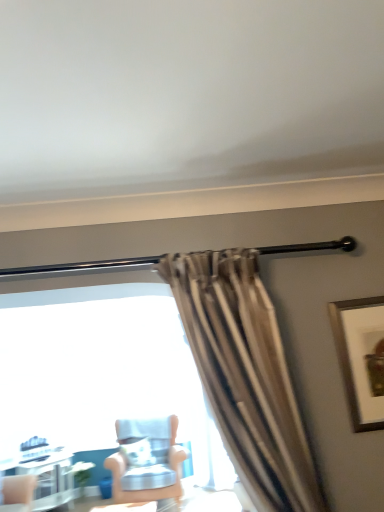
Identify the location of wooden framed artwork at upper right. This screenshot has width=384, height=512. (361, 358).

Can you confirm if light blue fabric chair at center is taller than white glossy table at lower left?

Indeed, light blue fabric chair at center has a greater height compared to white glossy table at lower left.

Is point (161, 471) positioned before point (47, 508)?

Yes, it is.

From a real-world perspective, is light blue fabric chair at center on white glossy table at lower left?

Indeed, from a real-world perspective, light blue fabric chair at center stands above white glossy table at lower left.

Can you confirm if light blue fabric chair at center is thinner than white glossy table at lower left?

In fact, light blue fabric chair at center might be wider than white glossy table at lower left.

Who is more distant, white glossy table at lower left or light blue fabric chair at center?

white glossy table at lower left is further from the camera.

Based on their positions, is white glossy table at lower left located to the left or right of light blue fabric chair at center?

Based on their positions, white glossy table at lower left is located to the left of light blue fabric chair at center.

From a real-world perspective, relative to light blue fabric chair at center, is white glossy table at lower left vertically above or below?

Clearly, from a real-world perspective, white glossy table at lower left is below light blue fabric chair at center.

In the scene shown: From the image's perspective, would you say white glossy table at lower left is positioned over light blue fabric chair at center?

No.

From the image's perspective, which is below, light blue fabric chair at center or wooden framed artwork at upper right?

light blue fabric chair at center.

Is light blue fabric chair at center far from wooden framed artwork at upper right?

Yes, light blue fabric chair at center is far from wooden framed artwork at upper right.

From the image's perspective, is wooden framed artwork at upper right on top of white glossy table at lower left?

Yes, from the image's perspective, wooden framed artwork at upper right is over white glossy table at lower left.

Locate an element on the screen. table located underneath the wooden framed artwork at upper right (from a real-world perspective) is located at coordinates (48, 477).

From a real-world perspective, is wooden framed artwork at upper right over white glossy table at lower left?

Indeed, from a real-world perspective, wooden framed artwork at upper right stands above white glossy table at lower left.

Which is behind, point (367, 366) or point (35, 449)?

The point (35, 449) is behind.

Considering the relative sizes of white glossy table at lower left and wooden framed artwork at upper right in the image provided, is white glossy table at lower left taller than wooden framed artwork at upper right?

Yes.

In the scene shown: Which of these two, white glossy table at lower left or wooden framed artwork at upper right, is thinner?

wooden framed artwork at upper right is thinner.

Is white glossy table at lower left far from wooden framed artwork at upper right?

white glossy table at lower left is far away from wooden framed artwork at upper right.

Is white glossy table at lower left smaller than wooden framed artwork at upper right?

No, white glossy table at lower left is not smaller than wooden framed artwork at upper right.

From the picture: From their relative heights in the image, would you say wooden framed artwork at upper right is taller or shorter than light blue fabric chair at center?

Clearly, wooden framed artwork at upper right is shorter compared to light blue fabric chair at center.

Considering the sizes of objects wooden framed artwork at upper right and light blue fabric chair at center in the image provided, who is wider, wooden framed artwork at upper right or light blue fabric chair at center?

Wider between the two is light blue fabric chair at center.

From a real-world perspective, which object stands above the other?

wooden framed artwork at upper right, from a real-world perspective.

Is light blue fabric chair at center located within wooden framed artwork at upper right?

No.

Find the location of a particular element. Image resolution: width=384 pixels, height=512 pixels. table beneath the light blue fabric chair at center (from a real-world perspective) is located at coordinates (48, 477).

Locate an element on the screen. This screenshot has width=384, height=512. chair on the right of white glossy table at lower left is located at coordinates (150, 465).

Which object lies nearer to the anchor point wooden framed artwork at upper right, white glossy table at lower left or light blue fabric chair at center?

Based on the image, light blue fabric chair at center appears to be nearer to wooden framed artwork at upper right.

When comparing their distances from wooden framed artwork at upper right, does light blue fabric chair at center or white glossy table at lower left seem further?

white glossy table at lower left.

Based on their spatial positions, is white glossy table at lower left or wooden framed artwork at upper right further from light blue fabric chair at center?

The object further to light blue fabric chair at center is wooden framed artwork at upper right.

Estimate the real-world distances between objects in this image. Which object is further from light blue fabric chair at center, wooden framed artwork at upper right or white glossy table at lower left?

wooden framed artwork at upper right lies further to light blue fabric chair at center than the other object.

Based on their spatial positions, is wooden framed artwork at upper right or light blue fabric chair at center further from white glossy table at lower left?

wooden framed artwork at upper right is positioned further to the anchor white glossy table at lower left.

Which object lies nearer to the anchor point white glossy table at lower left, light blue fabric chair at center or wooden framed artwork at upper right?

The object closer to white glossy table at lower left is light blue fabric chair at center.

In order to click on chair between wooden framed artwork at upper right and white glossy table at lower left in the front-back direction in this screenshot , I will do `click(150, 465)`.